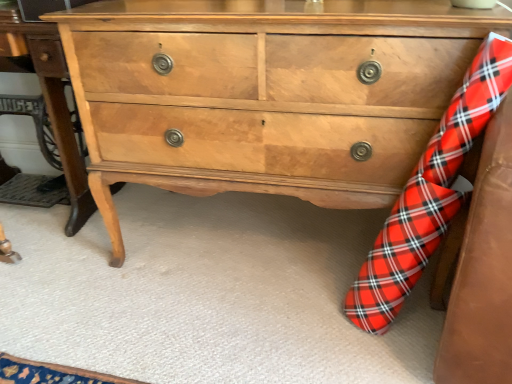
Question: Considering the relative sizes of red plaid sock at lower right and light brown wood chest of drawers at center in the image provided, is red plaid sock at lower right taller than light brown wood chest of drawers at center?

Choices:
 (A) no
 (B) yes

Answer: (B)

Question: Is red plaid sock at lower right oriented away from light brown wood chest of drawers at center?

Choices:
 (A) no
 (B) yes

Answer: (B)

Question: Can you confirm if red plaid sock at lower right is positioned to the left of light brown wood chest of drawers at center?

Choices:
 (A) no
 (B) yes

Answer: (A)

Question: Considering the relative sizes of red plaid sock at lower right and light brown wood chest of drawers at center in the image provided, is red plaid sock at lower right thinner than light brown wood chest of drawers at center?

Choices:
 (A) yes
 (B) no

Answer: (A)

Question: Is red plaid sock at lower right at the right side of light brown wood chest of drawers at center?

Choices:
 (A) no
 (B) yes

Answer: (B)

Question: Is red plaid sock at lower right positioned behind light brown wood chest of drawers at center?

Choices:
 (A) no
 (B) yes

Answer: (A)

Question: From the image's perspective, is light brown wood table at center over red plaid sock at lower right?

Choices:
 (A) no
 (B) yes

Answer: (B)

Question: Is light brown wood table at center behind red plaid sock at lower right?

Choices:
 (A) yes
 (B) no

Answer: (A)

Question: Does light brown wood table at center touch red plaid sock at lower right?

Choices:
 (A) no
 (B) yes

Answer: (A)

Question: Is light brown wood table at center thinner than red plaid sock at lower right?

Choices:
 (A) yes
 (B) no

Answer: (B)

Question: From a real-world perspective, is light brown wood table at center over red plaid sock at lower right?

Choices:
 (A) yes
 (B) no

Answer: (A)

Question: From a real-world perspective, does light brown wood table at center sit lower than red plaid sock at lower right?

Choices:
 (A) no
 (B) yes

Answer: (A)

Question: Is red plaid sock at lower right to the right of light brown wood table at center from the viewer's perspective?

Choices:
 (A) no
 (B) yes

Answer: (B)